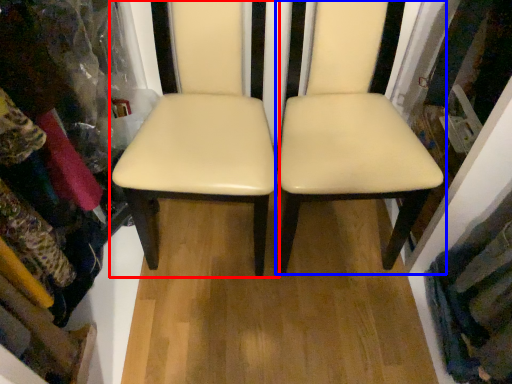
Question: Which object appears farthest to the camera in this image, chair (highlighted by a red box) or chair (highlighted by a blue box)?

Choices:
 (A) chair
 (B) chair

Answer: (A)